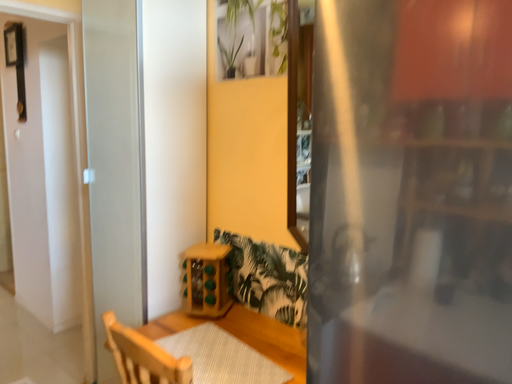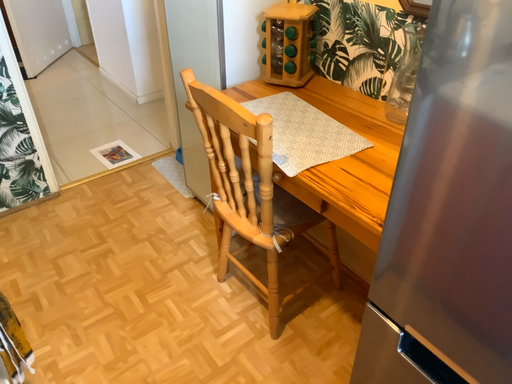
Question: How did the camera likely rotate when shooting the video?

Choices:
 (A) rotated left
 (B) rotated right

Answer: (A)